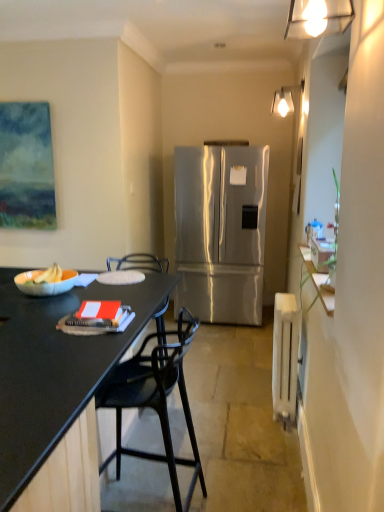
Question: Is matte white bowl at left outside white plastic radiator at right?

Choices:
 (A) yes
 (B) no

Answer: (A)

Question: Would you say white plastic radiator at right is part of matte white bowl at left's contents?

Choices:
 (A) no
 (B) yes

Answer: (A)

Question: From a real-world perspective, does matte white bowl at left stand above white plastic radiator at right?

Choices:
 (A) no
 (B) yes

Answer: (B)

Question: From the image's perspective, is matte white bowl at left on white plastic radiator at right?

Choices:
 (A) yes
 (B) no

Answer: (A)

Question: Considering the relative positions of matte white bowl at left and white plastic radiator at right in the image provided, is matte white bowl at left to the left of white plastic radiator at right from the viewer's perspective?

Choices:
 (A) yes
 (B) no

Answer: (A)

Question: Relative to matte white light fixture at upper center, the second lamp in the bottom-to-top sequence, is black plastic chair at left in front or behind?

Choices:
 (A) front
 (B) behind

Answer: (A)

Question: Is black plastic chair at left wider or thinner than matte white light fixture at upper center, the second lamp in the bottom-to-top sequence?

Choices:
 (A) thin
 (B) wide

Answer: (B)

Question: Considering the positions of point (135, 402) and point (273, 109), is point (135, 402) closer or farther from the camera than point (273, 109)?

Choices:
 (A) farther
 (B) closer

Answer: (B)

Question: Based on their positions, is black plastic chair at left located to the left or right of matte white light fixture at upper center, marked as the 2th lamp in a front-to-back arrangement?

Choices:
 (A) right
 (B) left

Answer: (B)

Question: In terms of width, does matte white light fixture at upper center, the 1th lamp in the top-to-bottom sequence, look wider or thinner when compared to matte white bowl at left?

Choices:
 (A) wide
 (B) thin

Answer: (B)

Question: Is matte white light fixture at upper center, the 1th lamp in the top-to-bottom sequence, in front of or behind matte white bowl at left in the image?

Choices:
 (A) behind
 (B) front

Answer: (A)

Question: Is matte white light fixture at upper center, the 1th lamp in the top-to-bottom sequence, spatially inside matte white bowl at left, or outside of it?

Choices:
 (A) outside
 (B) inside

Answer: (A)

Question: In terms of height, does matte white light fixture at upper center, marked as the 2th lamp in a front-to-back arrangement, look taller or shorter compared to matte white bowl at left?

Choices:
 (A) tall
 (B) short

Answer: (A)

Question: Is black matte desk at left spatially inside black plastic chair at left, or outside of it?

Choices:
 (A) inside
 (B) outside

Answer: (B)

Question: Does point (41, 403) appear closer or farther from the camera than point (122, 384)?

Choices:
 (A) closer
 (B) farther

Answer: (A)